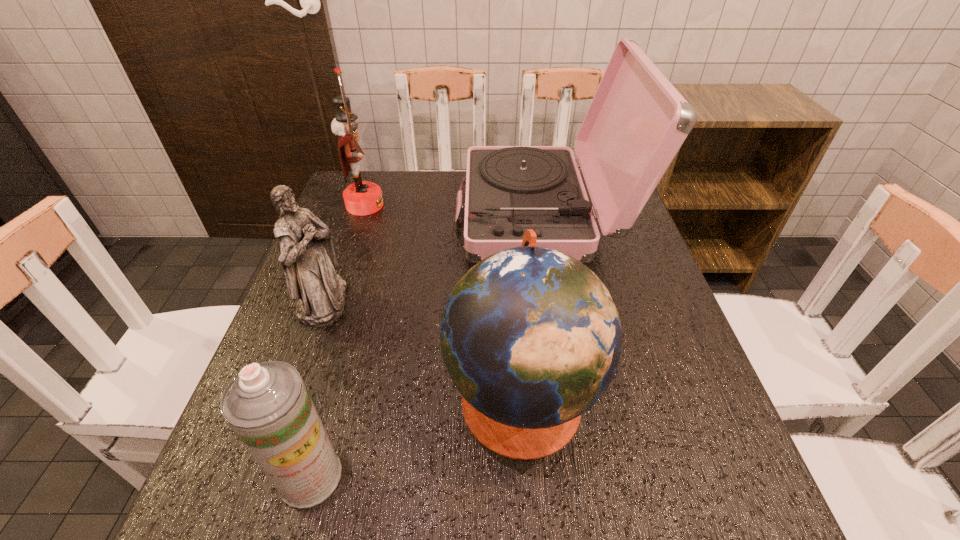
Find the location of `free region located 0.080m with the Americas facing the viewer on the globe`. free region located 0.080m with the Americas facing the viewer on the globe is located at coordinates (403, 396).

Identify the location of free space located 0.210m with the Americas facing the viewer on the globe. (332, 396).

The height and width of the screenshot is (540, 960). In order to click on vacant space located on the front-facing side of the figurine in this screenshot , I will do `click(410, 302)`.

Image resolution: width=960 pixels, height=540 pixels. I want to click on free space located on the back of the aerosol can, so click(x=326, y=420).

The image size is (960, 540). What are the coordinates of `record player that is at the far edge` in the screenshot? It's located at (637, 121).

You are a GUI agent. You are given a task and a screenshot of the screen. Output one action in this format:
    pyautogui.click(x=<x>, y=<y>)
    Task: Click on the nutcracker at the far edge
    Image resolution: width=960 pixels, height=540 pixels.
    Given the screenshot: What is the action you would take?
    pyautogui.click(x=361, y=198)

This screenshot has width=960, height=540. I want to click on object present at the near edge, so click(x=267, y=405).

Where is `nutcracker that is positioned at the left edge`? The image size is (960, 540). nutcracker that is positioned at the left edge is located at coordinates (361, 198).

Where is `figurine present at the left edge`? Image resolution: width=960 pixels, height=540 pixels. figurine present at the left edge is located at coordinates (308, 259).

The height and width of the screenshot is (540, 960). Find the location of `aerosol can present at the left edge`. aerosol can present at the left edge is located at coordinates (267, 405).